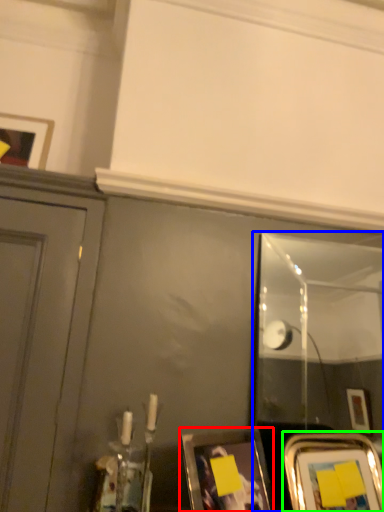
Question: Estimate the real-world distances between objects in this image. Which object is farther from picture frame (highlighted by a red box), mirror (highlighted by a blue box) or picture frame (highlighted by a green box)?

Choices:
 (A) mirror
 (B) picture frame

Answer: (A)